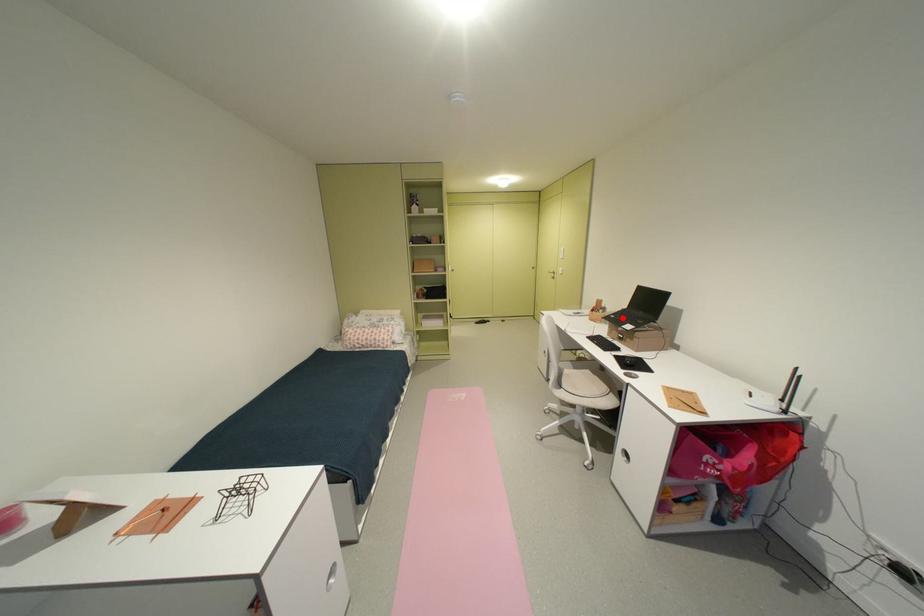
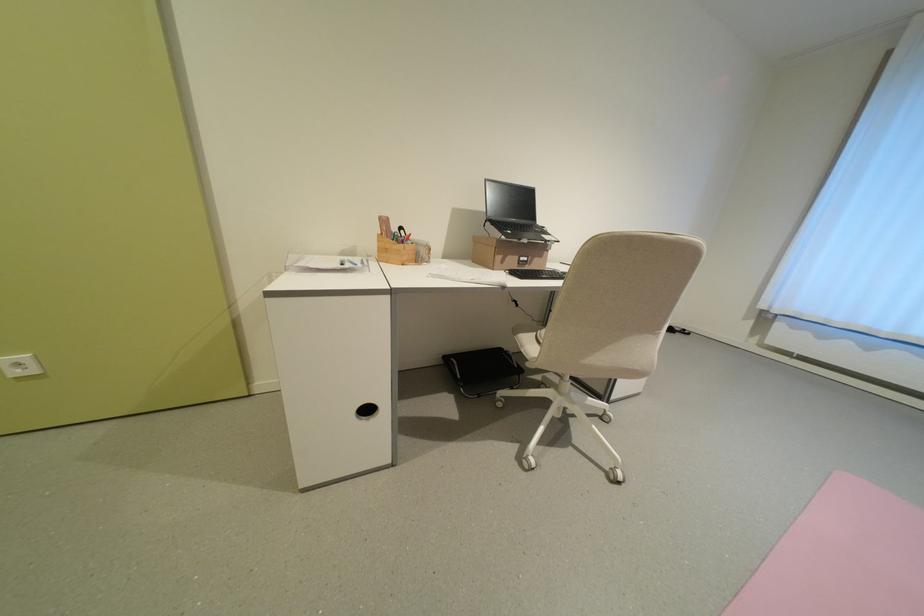
Where in the second image is the point corresponding to the highlighted location from the first image?

(518, 233)